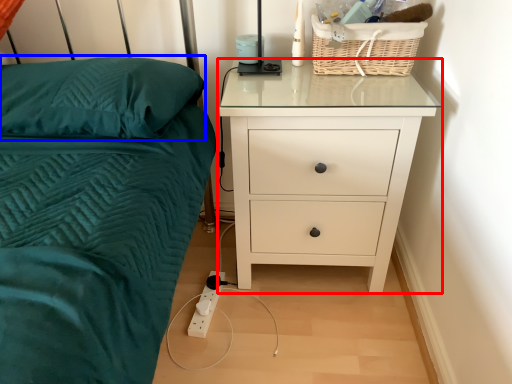
Question: Which object is further to the camera taking this photo, chest of drawers (highlighted by a red box) or pillow (highlighted by a blue box)?

Choices:
 (A) chest of drawers
 (B) pillow

Answer: (A)